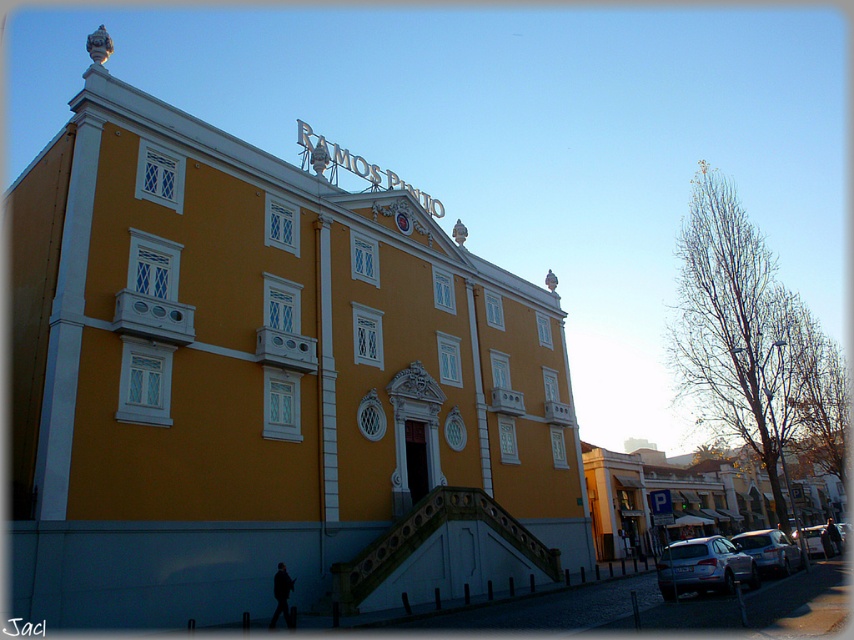
You are standing in front of the Ramos Patio building. You want to know how far the point at coordinates (331, 525) is from you. Can you determine the distance?

The point at coordinates (331, 525) is 148.14 feet away from the viewer.

You are a photographer standing in front of the Ramos Patio building. You want to capture a photo that includes both the satin silver suv at lower right and the satin silver car at lower right. Which vehicle should you position closer to the camera to ensure both are fully visible in the frame?

To ensure both the satin silver suv at lower right and the satin silver car at lower right are fully visible in the frame, you should position the satin silver suv at lower right closer to the camera since it is smaller than the satin silver car at lower right. This way, the smaller SUV can be brought into better focus while still capturing the larger car in the background.

You are standing in front of the Ramos Patio building and want to park your car. The parking spot you want is at point (769, 550). Is the satin silver car at lower right blocking your parking spot?

The satin silver car at lower right is located at point (769, 550), so yes, the satin silver car at lower right is blocking your parking spot.